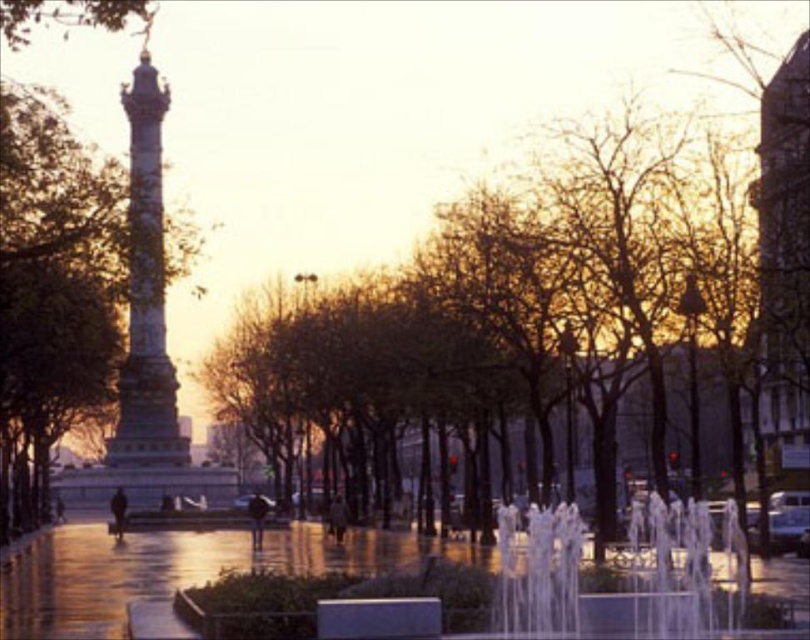
You are an architect designing a new sculpture that needs to be placed between the brick textured tower at right and the polished gold column at center. Based on their positions, where should the sculpture be placed to ensure it is between both structures?

The sculpture should be placed between the brick textured tower at right and the polished gold column at center, as the brick textured tower at right is located below the polished gold column at center, meaning the column is above the tower. Therefore, positioning the sculpture in the middle vertical space between them would place it between both structures.

From the picture: You are an architect designing a new sculpture to be placed between the brick textured tower at right and the polished gold column at center. The sculpture must be taller than both existing structures. Which of the two should the sculpture be placed closer to in order to maintain visual balance?

The sculpture should be placed closer to the brick textured tower at right because it is shorter than the polished gold column at center. Placing the taller sculpture closer to the shorter tower will help balance the composition by counteracting the height difference between the two existing structures.